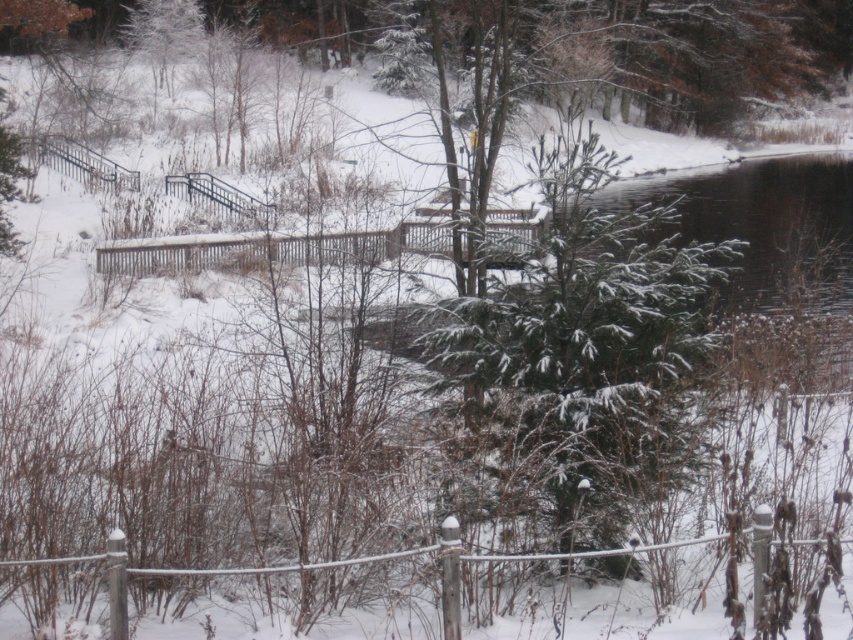
From the picture: You are a photographer setting up a camera in the winter scene. You want to capture both the green textured evergreen tree at center and the white wooden fence at center in your shot. Which object will appear wider in the photograph?

The green textured evergreen tree at center will appear wider in the photograph because its width is larger than that of the white wooden fence at center.

You are a photographer setting up a shot of the winter scene. You want to ensure both the green textured evergreen tree at center and the white wooden fence at center are clearly visible in your composition. Based on their positions, which object should you focus on first to ensure both are in focus?

Since the white wooden fence at center is behind the green textured evergreen tree at center, you should focus on the white wooden fence at center first. This way, both the foreground tree and the background fence will be in focus.